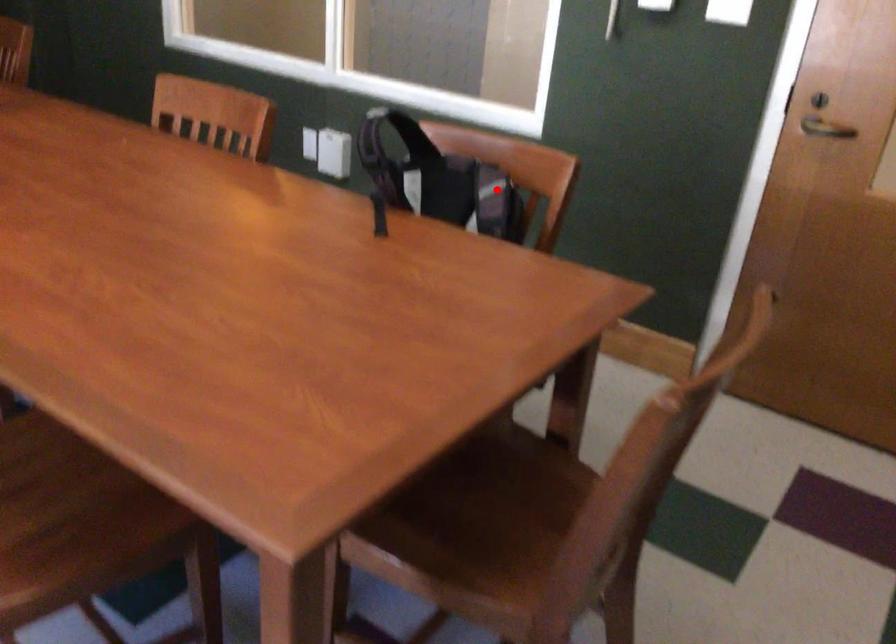
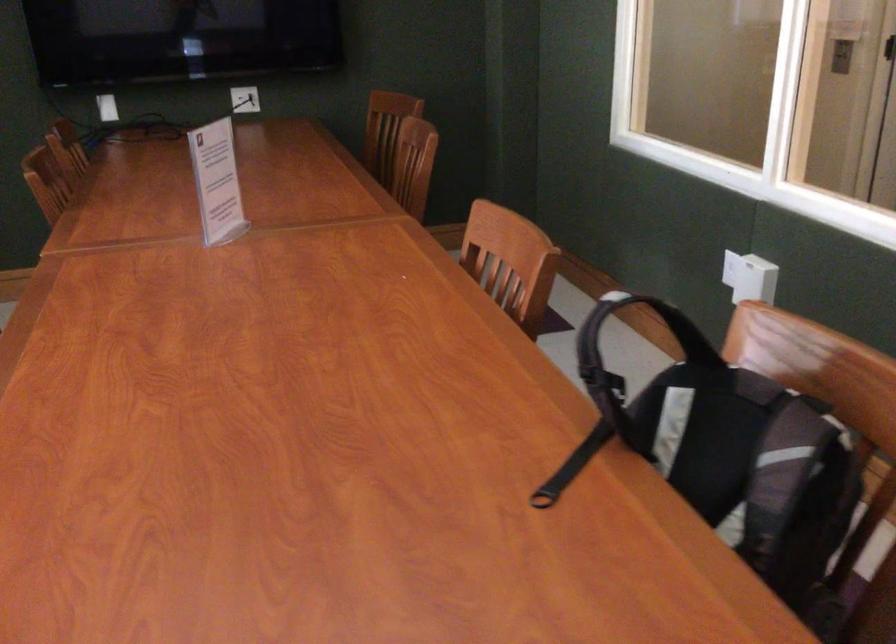
Question: A red point is marked in image1. In image2, is the corresponding 3D point closer to the camera or farther? Reply with the corresponding letter.

Choices:
 (A) The corresponding 3D point is closer.
 (B) The corresponding 3D point is farther.

Answer: (A)